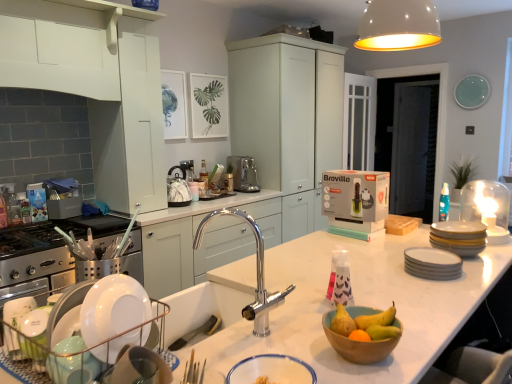
Question: Can you confirm if white matte cabinet at upper left, positioned as the third cabinetry in right-to-left order, is shorter than wooden bowl at center, which ranks as the 1th basin in right-to-left order?

Choices:
 (A) no
 (B) yes

Answer: (A)

Question: Considering the relative positions of white matte cabinet at upper left, positioned as the third cabinetry in right-to-left order, and wooden bowl at center, marked as the second basin in a left-to-right arrangement, in the image provided, is white matte cabinet at upper left, positioned as the third cabinetry in right-to-left order, to the left of wooden bowl at center, marked as the second basin in a left-to-right arrangement, from the viewer's perspective?

Choices:
 (A) no
 (B) yes

Answer: (B)

Question: Is white matte cabinet at upper left, positioned as the third cabinetry in right-to-left order, facing towards wooden bowl at center, marked as the second basin in a left-to-right arrangement?

Choices:
 (A) no
 (B) yes

Answer: (A)

Question: Is white matte cabinet at upper left, which is counted as the first cabinetry, starting from the left, positioned with its back to wooden bowl at center, marked as the second basin in a left-to-right arrangement?

Choices:
 (A) yes
 (B) no

Answer: (B)

Question: From a real-world perspective, does white matte cabinet at upper left, which is counted as the first cabinetry, starting from the left, stand above wooden bowl at center, which ranks as the 1th basin in right-to-left order?

Choices:
 (A) yes
 (B) no

Answer: (A)

Question: Is white matte cabinet at upper left, which is counted as the first cabinetry, starting from the left, bigger than wooden bowl at center, marked as the second basin in a left-to-right arrangement?

Choices:
 (A) no
 (B) yes

Answer: (B)

Question: Is smooth wooden bowl at center, placed as the first fruit when sorted from right to left, further to camera compared to matte yellow pear at center, the 2th fruit from the right?

Choices:
 (A) no
 (B) yes

Answer: (B)

Question: From the image's perspective, is smooth wooden bowl at center, the 2th fruit in the left-to-right sequence, under matte yellow pear at center, the 2th fruit from the right?

Choices:
 (A) no
 (B) yes

Answer: (B)

Question: Does smooth wooden bowl at center, placed as the first fruit when sorted from right to left, contain matte yellow pear at center, which ranks as the first fruit in left-to-right order?

Choices:
 (A) no
 (B) yes

Answer: (A)

Question: Is smooth wooden bowl at center, placed as the first fruit when sorted from right to left, facing away from matte yellow pear at center, which ranks as the first fruit in left-to-right order?

Choices:
 (A) no
 (B) yes

Answer: (A)

Question: Is smooth wooden bowl at center, the 2th fruit in the left-to-right sequence, oriented towards matte yellow pear at center, which ranks as the first fruit in left-to-right order?

Choices:
 (A) no
 (B) yes

Answer: (A)

Question: From a real-world perspective, does smooth wooden bowl at center, placed as the first fruit when sorted from right to left, sit lower than matte yellow pear at center, which ranks as the first fruit in left-to-right order?

Choices:
 (A) no
 (B) yes

Answer: (B)

Question: Does matte white cabinets at center, which is the third cabinetry from front to back, come in front of yellow matte plates at right, placed as the 2th appliance when sorted from bottom to top?

Choices:
 (A) yes
 (B) no

Answer: (B)